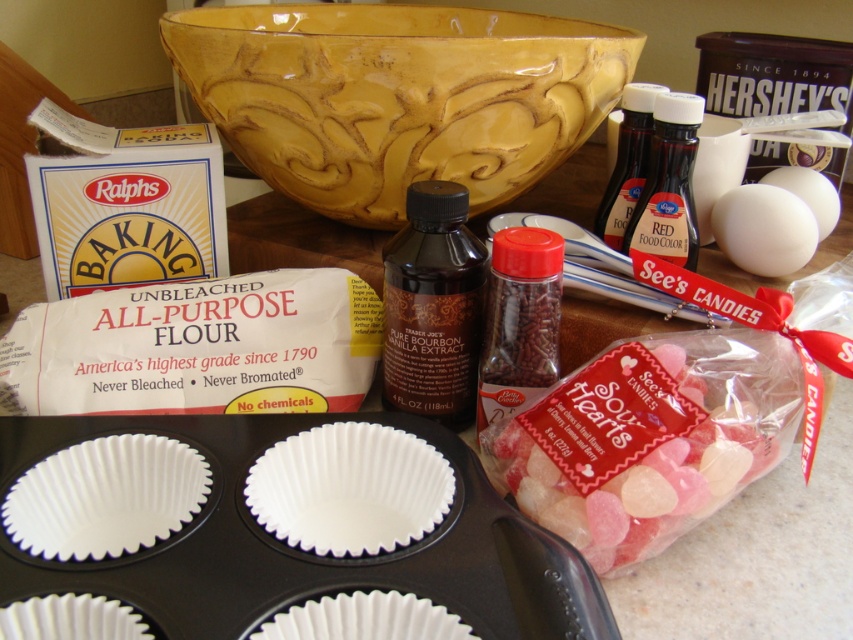
You are a baker preparing to mix ingredients. You have a pink translucent hearts at center right and dark brown liquid at center. How far apart are these two items?

The pink translucent hearts at center right and dark brown liquid at center are 3.60 inches apart.